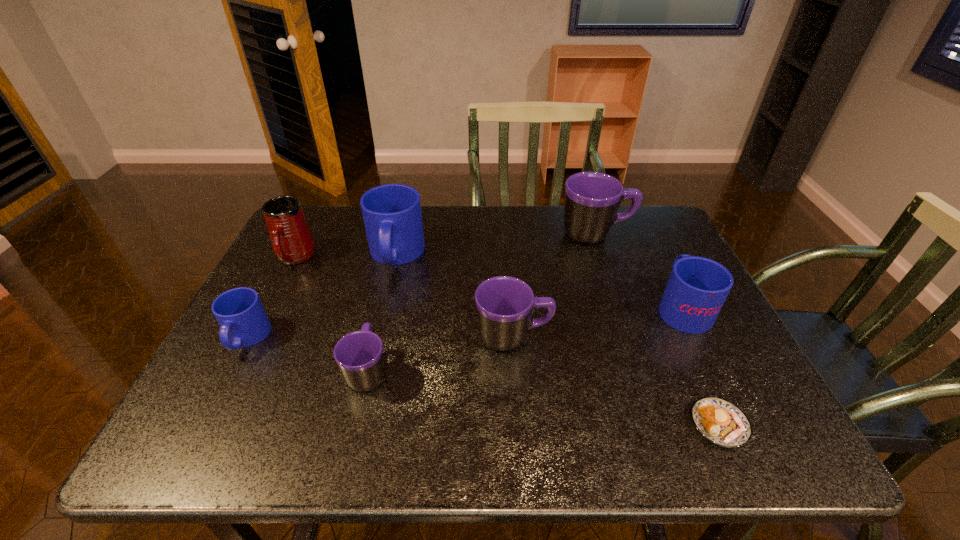
This screenshot has width=960, height=540. I want to click on vacant space located with the handle on the side of the smallest black mug, so click(x=395, y=258).

What are the coordinates of `free region located 0.050m with the handle on the side of the smallest black mug` in the screenshot? It's located at (377, 331).

This screenshot has height=540, width=960. I want to click on free region located 0.160m with the handle on the side of the smallest black mug, so click(385, 299).

Find the location of a particular element. This screenshot has height=540, width=960. blank space located 0.290m on the left of the pastry is located at coordinates (543, 424).

Locate an element on the screen. This screenshot has width=960, height=540. object at the near edge is located at coordinates (721, 422).

The image size is (960, 540). What are the coordinates of `pastry located at the right edge` in the screenshot? It's located at (721, 422).

At what (x,y) coordinates should I click in order to perform the action: click on object that is at the far left corner. Please return your answer as a coordinate pair (x, y). The width and height of the screenshot is (960, 540). Looking at the image, I should click on (292, 241).

Locate an element on the screen. The image size is (960, 540). object that is positioned at the far right corner is located at coordinates (592, 199).

Image resolution: width=960 pixels, height=540 pixels. Find the location of `object that is at the near right corner`. object that is at the near right corner is located at coordinates (721, 422).

The image size is (960, 540). Find the location of `free spot at the far edge of the desktop`. free spot at the far edge of the desktop is located at coordinates (444, 221).